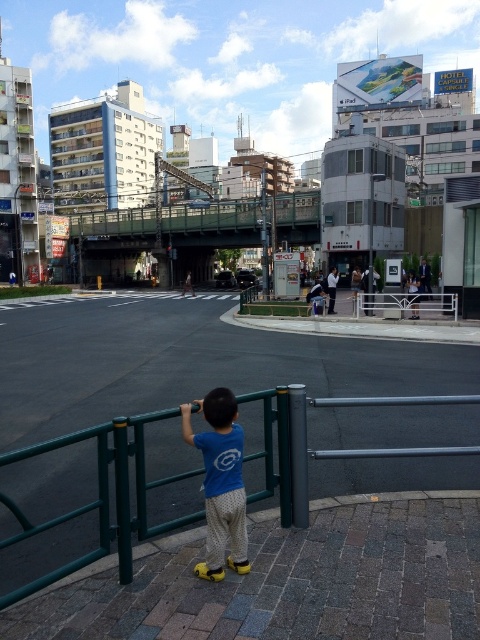
You are a delivery robot with a width of 16 inches. You need to move from the green metal fence at lower center to the blue cotton shirt at center. Is there enough space for you to pass through the area between them?

The distance between the green metal fence at lower center and the blue cotton shirt at center is 15.65 inches. Since the robot is 16 inches wide, it cannot pass through the space between them as the distance is narrower than the robot.

You are a delivery person who needs to place a small package on the sidewalk. The package is the same size as the blue cotton shirt at center. Can you place it on the green metal fence at lower center without it falling off?

The green metal fence at lower center is bigger than the blue cotton shirt at center, so the package can be placed on the green metal fence at lower center without falling off since it has enough space.